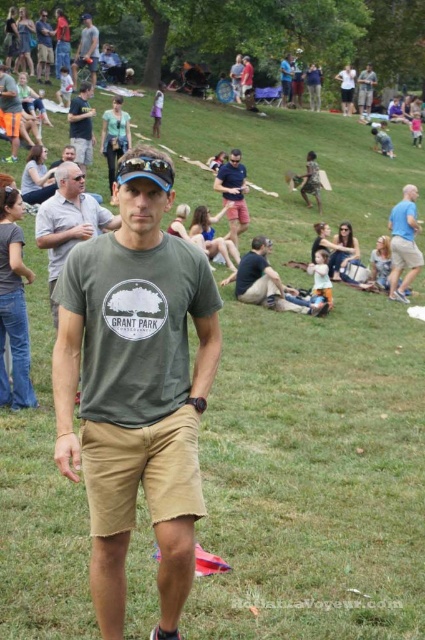
Question: Which object is farther from the camera taking this photo?

Choices:
 (A) dark green t-shirt at center
 (B) matte gray shirt at upper left

Answer: (B)

Question: Does blue cotton shirt at center appear on the left side of matte gray shirt at upper left?

Choices:
 (A) no
 (B) yes

Answer: (A)

Question: Among these points, which one is nearest to the camera?

Choices:
 (A) (266, 262)
 (B) (235, 173)
 (C) (51, 316)

Answer: (C)

Question: Which is nearer to the khaki shorts at center?

Choices:
 (A) matte green t-shirt at center
 (B) matte gray shirt at upper left

Answer: (A)

Question: Does blue cotton shirt at right have a greater width compared to matte gray shirt at upper left?

Choices:
 (A) yes
 (B) no

Answer: (B)

Question: Does blue cotton shirt at center appear on the left side of matte green t-shirt at center?

Choices:
 (A) no
 (B) yes

Answer: (A)